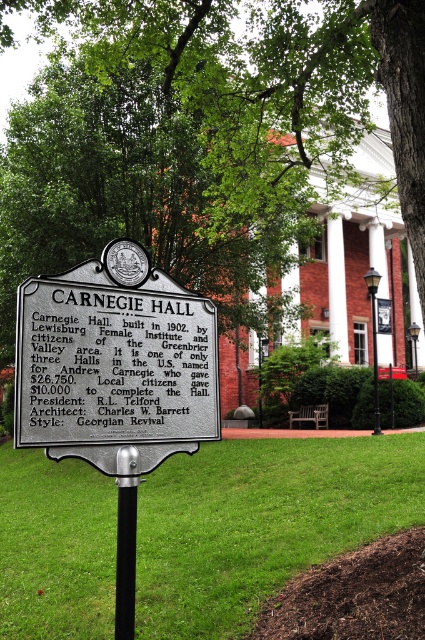
You are a landscape architect designing a new park and want to ensure that the green leafy tree at upper center and the green grass at center are visible from a walking path. Given their height difference, which object will likely block the view of the other when viewed from the path?

The green leafy tree at upper center is taller than the green grass at center, so the tree will block the view of the grass from the walking path.